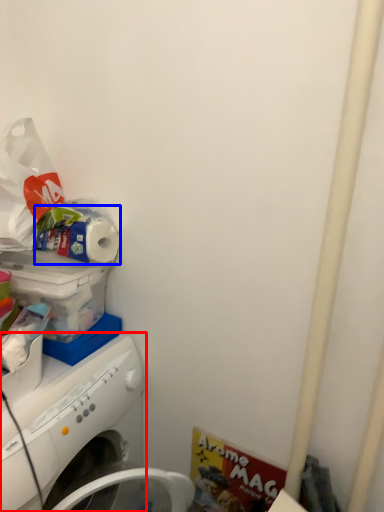
Question: Which point is closer to the camera, washing machine (highlighted by a red box) or toilet paper (highlighted by a blue box)?

Choices:
 (A) washing machine
 (B) toilet paper

Answer: (A)